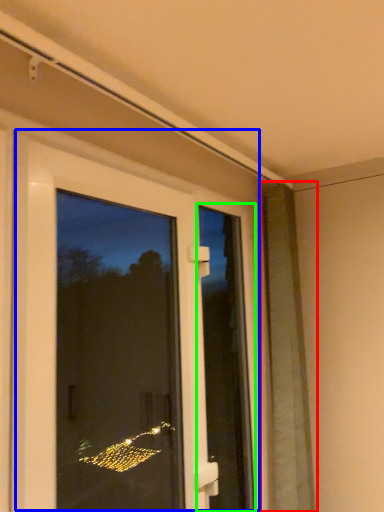
Question: Estimate the real-world distances between objects in this image. Which object is farther from shutter (highlighted by a red box), door (highlighted by a blue box) or screen door (highlighted by a green box)?

Choices:
 (A) door
 (B) screen door

Answer: (A)